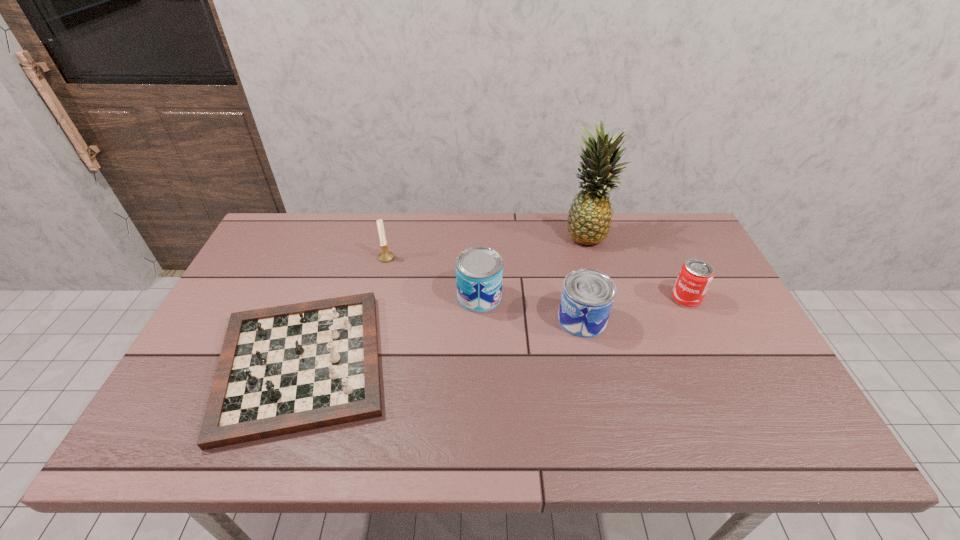
At what (x,y) coordinates should I click in order to perform the action: click on free space between the fifth nearest object and the leftmost can. Please return your answer as a coordinate pair (x, y). Looking at the image, I should click on (433, 277).

You are a GUI agent. You are given a task and a screenshot of the screen. Output one action in this format:
    pyautogui.click(x=<x>, y=<y>)
    Task: Click on the free space between the farthest object and the rightmost can
    This screenshot has width=960, height=540.
    Given the screenshot: What is the action you would take?
    pyautogui.click(x=636, y=267)

Where is `vacant area that lies between the tallest object and the rightmost can`? The height and width of the screenshot is (540, 960). vacant area that lies between the tallest object and the rightmost can is located at coordinates (636, 267).

At what (x,y) coordinates should I click in order to perform the action: click on vacant area between the leftmost can and the chessboard. Please return your answer as a coordinate pair (x, y). The height and width of the screenshot is (540, 960). Looking at the image, I should click on (391, 330).

Where is `object identified as the fifth closest to the second farthest object`? The width and height of the screenshot is (960, 540). object identified as the fifth closest to the second farthest object is located at coordinates (695, 276).

Select which object is the second closest to the farthest object. Please provide its 2D coordinates. Your answer should be formatted as a tuple, i.e. [(x, y)], where the tuple contains the x and y coordinates of a point satisfying the conditions above.

[(587, 297)]

Select which can appears as the second closest to the leftmost can. Please provide its 2D coordinates. Your answer should be formatted as a tuple, i.e. [(x, y)], where the tuple contains the x and y coordinates of a point satisfying the conditions above.

[(695, 276)]

Locate which can is the second closest to the farthest object. Please provide its 2D coordinates. Your answer should be formatted as a tuple, i.e. [(x, y)], where the tuple contains the x and y coordinates of a point satisfying the conditions above.

[(587, 297)]

Image resolution: width=960 pixels, height=540 pixels. In order to click on free point that satisfies the following two spatial constraints: 1. on the back side of the shortest object; 2. on the right side of the rightmost can in this screenshot , I will do `click(324, 299)`.

Image resolution: width=960 pixels, height=540 pixels. I want to click on free space in the image that satisfies the following two spatial constraints: 1. on the front side of the fifth nearest object; 2. on the right side of the rightmost can, so click(x=376, y=299).